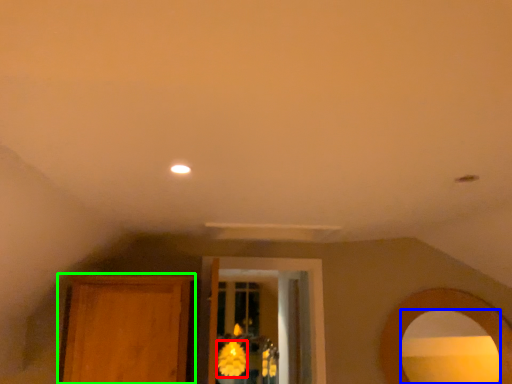
Question: Which object is positioned farthest from flower (highlighted by a red box)? Select from mirror (highlighted by a blue box) and armoire (highlighted by a green box).

Choices:
 (A) mirror
 (B) armoire

Answer: (A)